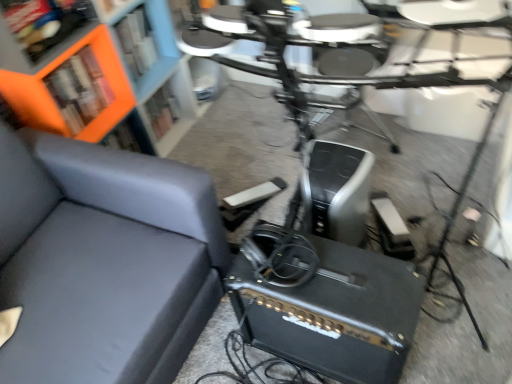
Question: Does orange matte bookcase at upper left appear on the left side of orange matte bookshelf at upper left?

Choices:
 (A) yes
 (B) no

Answer: (A)

Question: Is orange matte bookcase at upper left further to camera compared to orange matte bookshelf at upper left?

Choices:
 (A) yes
 (B) no

Answer: (B)

Question: From the image's perspective, would you say orange matte bookcase at upper left is positioned over orange matte bookshelf at upper left?

Choices:
 (A) yes
 (B) no

Answer: (A)

Question: Can we say orange matte bookcase at upper left lies outside orange matte bookshelf at upper left?

Choices:
 (A) no
 (B) yes

Answer: (B)

Question: Does orange matte bookcase at upper left have a greater height compared to orange matte bookshelf at upper left?

Choices:
 (A) yes
 (B) no

Answer: (A)

Question: From a real-world perspective, is orange matte bookcase at upper left physically above orange matte bookshelf at upper left?

Choices:
 (A) no
 (B) yes

Answer: (B)

Question: Is orange matte bookshelf at upper left wider than orange matte bookcase at upper left?

Choices:
 (A) no
 (B) yes

Answer: (A)

Question: Is orange matte bookshelf at upper left beside orange matte bookcase at upper left?

Choices:
 (A) no
 (B) yes

Answer: (A)

Question: Are orange matte bookshelf at upper left and orange matte bookcase at upper left located far from each other?

Choices:
 (A) yes
 (B) no

Answer: (B)

Question: From a real-world perspective, is orange matte bookshelf at upper left positioned over orange matte bookcase at upper left based on gravity?

Choices:
 (A) no
 (B) yes

Answer: (A)

Question: Considering the relative sizes of orange matte bookshelf at upper left and orange matte bookcase at upper left in the image provided, is orange matte bookshelf at upper left smaller than orange matte bookcase at upper left?

Choices:
 (A) yes
 (B) no

Answer: (A)

Question: Could you tell me if orange matte bookshelf at upper left is turned towards orange matte bookcase at upper left?

Choices:
 (A) yes
 (B) no

Answer: (A)

Question: Considering the relative sizes of orange matte bookcase at upper left and matte gray couch at left in the image provided, is orange matte bookcase at upper left bigger than matte gray couch at left?

Choices:
 (A) no
 (B) yes

Answer: (A)